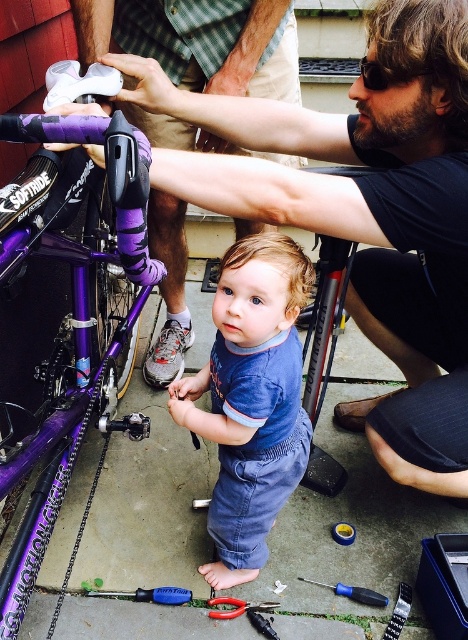
You are a repair technician who needs to reach both the blue plastic screwdriver at lower center and the blue plastic screwdriver at center. If your tool kit can only hold one screwdriver at a time, which screwdriver should you pick first to minimize the distance you walk?

The blue plastic screwdriver at lower center and blue plastic screwdriver at center are 13.76 inches apart from each other. To minimize walking distance, you should pick the one closer to your current position. However, since the exact location of the technician isnecessary to determine which is closer, the answer cannot be definitively provided without that information.

What are the coordinates of the purple matte bicycle at left?

The purple matte bicycle at left is located at coordinates point (74, 328).